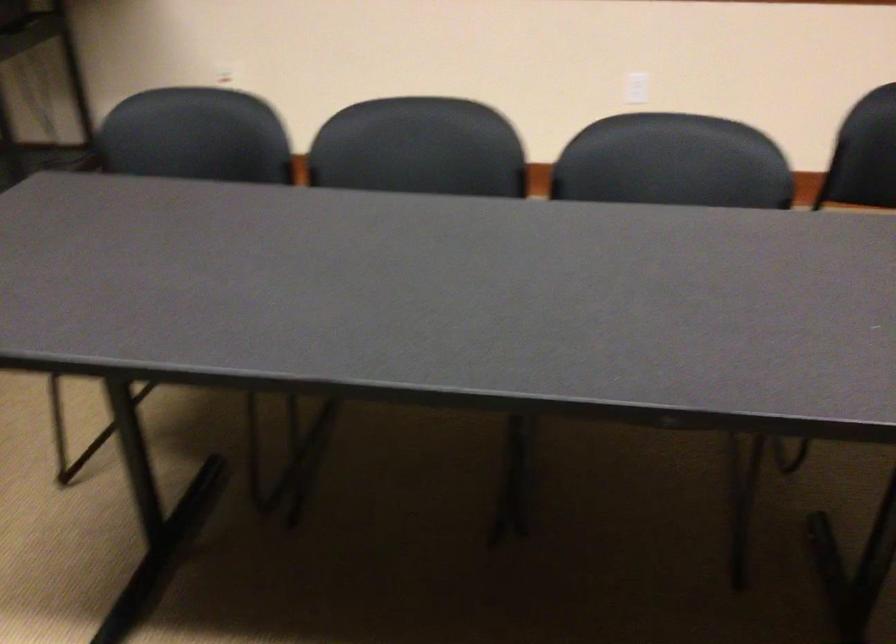
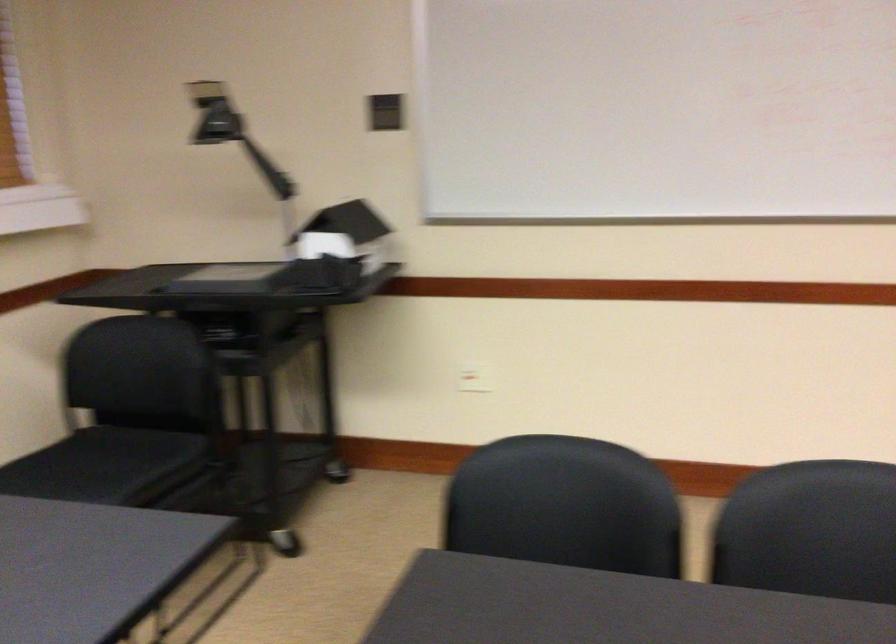
What movement of the cameraman would produce the second image?

The cameraman moved toward left, forward.